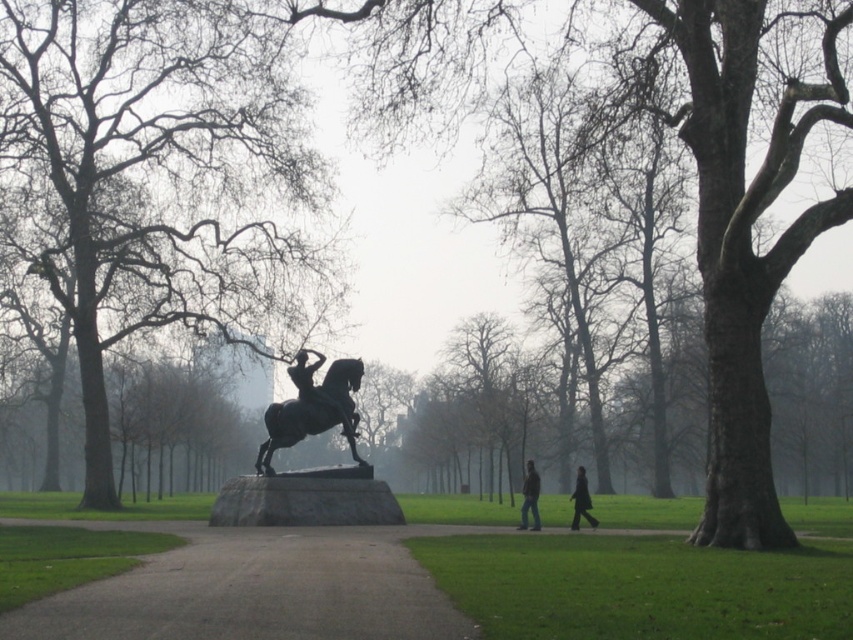
You are standing in the park and see the smooth bark tree at center and the dark gray jeans at center. Which object is positioned to the left of the other?

The smooth bark tree at center is to the left of dark gray jeans at center.